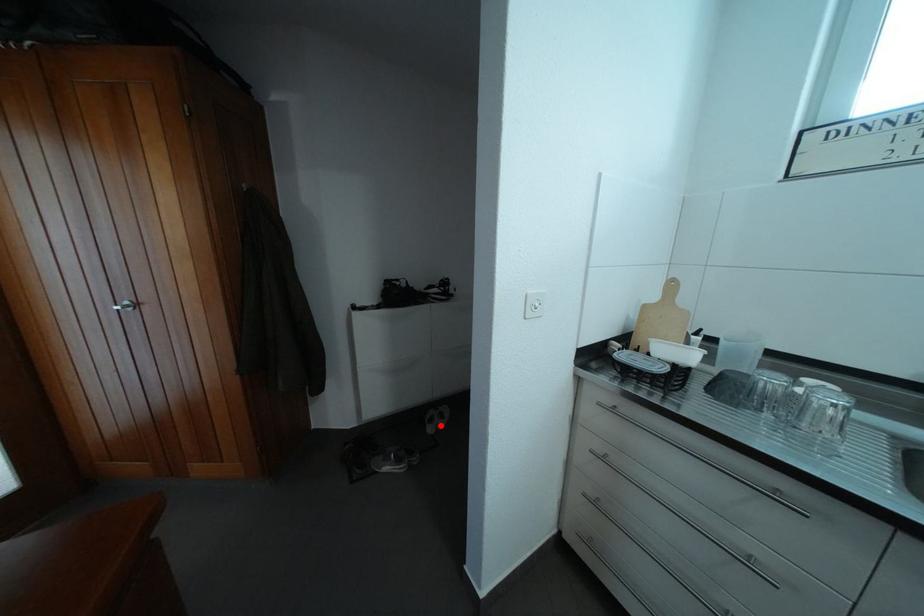
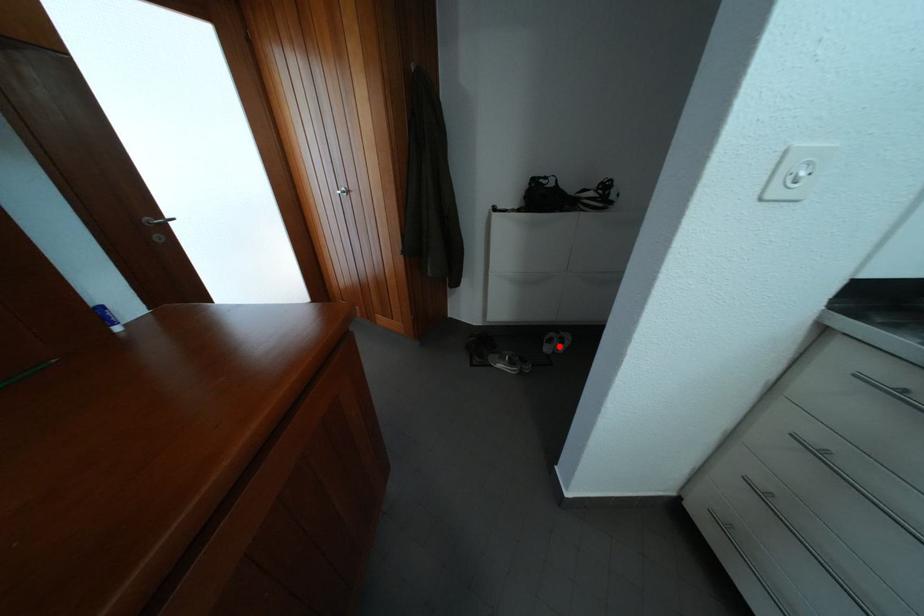
I am providing you with two images of the same scene from different viewpoints. A red point is marked on the first image and another point is marked on the second image. Is the marked point in image1 the same physical position as the marked point in image2?

Yes